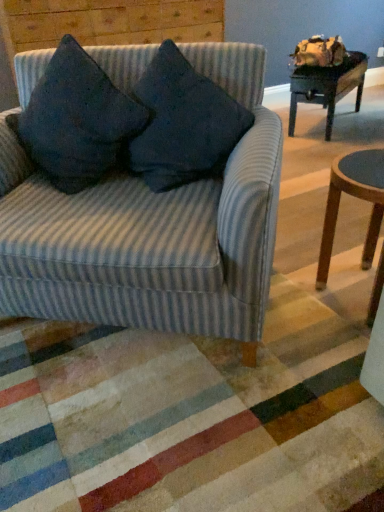
You are a GUI agent. You are given a task and a screenshot of the screen. Output one action in this format:
    pyautogui.click(x=<x>, y=<y>)
    Task: Click on the unoccupied space behind wooden round stool at lower right
    Image resolution: width=384 pixels, height=512 pixels.
    Given the screenshot: What is the action you would take?
    pyautogui.click(x=317, y=245)